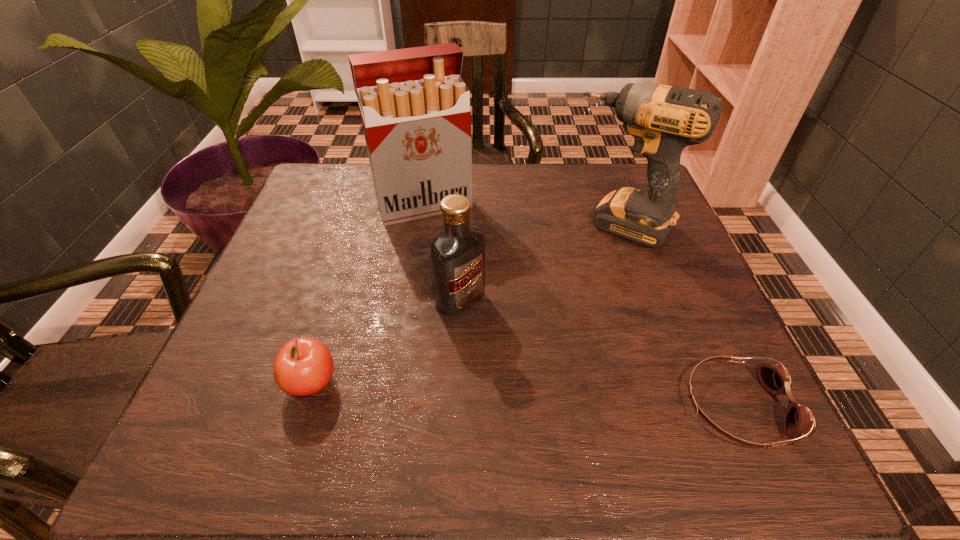
You are a GUI agent. You are given a task and a screenshot of the screen. Output one action in this format:
    pyautogui.click(x=<x>, y=<y>)
    Task: Click on the object that stands as the second closest to the cigarette case
    
    Given the screenshot: What is the action you would take?
    pyautogui.click(x=663, y=120)

This screenshot has height=540, width=960. Find the location of `object that stands as the second closest to the cigarette case`. object that stands as the second closest to the cigarette case is located at coordinates (663, 120).

The height and width of the screenshot is (540, 960). What are the coordinates of `free space that satisfies the following two spatial constraints: 1. on the front side of the drill; 2. on the right side of the cigarette case` in the screenshot? It's located at (421, 226).

Find the location of `vacant area in the image that satisfies the following two spatial constraints: 1. on the front side of the cigarette case; 2. through the lenses of the shortest object`. vacant area in the image that satisfies the following two spatial constraints: 1. on the front side of the cigarette case; 2. through the lenses of the shortest object is located at coordinates (394, 407).

Locate an element on the screen. Image resolution: width=960 pixels, height=540 pixels. vacant space that satisfies the following two spatial constraints: 1. on the back side of the second shortest object; 2. on the right side of the drill is located at coordinates (360, 226).

Image resolution: width=960 pixels, height=540 pixels. Find the location of `vacant space that satisfies the following two spatial constraints: 1. on the back side of the third shortest object; 2. on the left side of the drill`. vacant space that satisfies the following two spatial constraints: 1. on the back side of the third shortest object; 2. on the left side of the drill is located at coordinates (463, 226).

What are the coordinates of `blank space that satisfies the following two spatial constraints: 1. on the front side of the vodka; 2. through the lenses of the goggles` in the screenshot? It's located at (455, 407).

You are a GUI agent. You are given a task and a screenshot of the screen. Output one action in this format:
    pyautogui.click(x=<x>, y=<y>)
    Task: Click on the free region that satisfies the following two spatial constraints: 1. on the back side of the drill; 2. on the right side of the apple
    The image size is (960, 540).
    Given the screenshot: What is the action you would take?
    pyautogui.click(x=360, y=226)